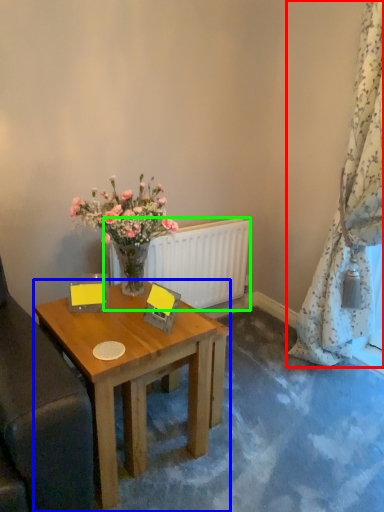
Question: Considering the real-world distances, which object is farthest from curtain (highlighted by a red box)? desk (highlighted by a blue box) or radiator (highlighted by a green box)?

Choices:
 (A) desk
 (B) radiator

Answer: (A)